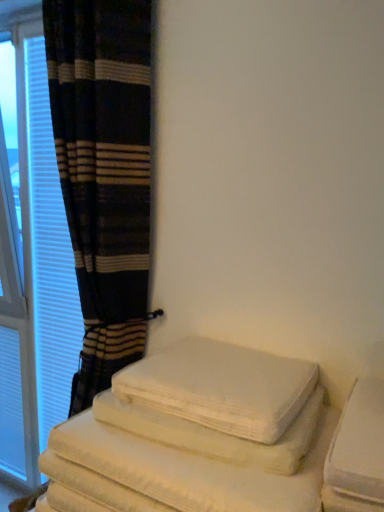
Question: Is white cotton bath towel at lower right in contact with plaid fabric curtain at left?

Choices:
 (A) yes
 (B) no

Answer: (B)

Question: Can you confirm if white cotton bath towel at lower right is shorter than plaid fabric curtain at left?

Choices:
 (A) no
 (B) yes

Answer: (B)

Question: Is white cotton bath towel at lower right oriented away from plaid fabric curtain at left?

Choices:
 (A) no
 (B) yes

Answer: (A)

Question: Is white cotton bath towel at lower right smaller than plaid fabric curtain at left?

Choices:
 (A) yes
 (B) no

Answer: (A)

Question: Can you confirm if white cotton bath towel at lower right is bigger than plaid fabric curtain at left?

Choices:
 (A) yes
 (B) no

Answer: (B)

Question: Is plaid fabric curtain at left wider or thinner than white soft towels at lower left?

Choices:
 (A) thin
 (B) wide

Answer: (A)

Question: Is plaid fabric curtain at left bigger or smaller than white soft towels at lower left?

Choices:
 (A) big
 (B) small

Answer: (A)

Question: From their relative heights in the image, would you say plaid fabric curtain at left is taller or shorter than white soft towels at lower left?

Choices:
 (A) tall
 (B) short

Answer: (A)

Question: Relative to white soft towels at lower left, is plaid fabric curtain at left in front or behind?

Choices:
 (A) front
 (B) behind

Answer: (B)

Question: Is white cotton bath towel at lower right wider or thinner than plaid fabric curtain at left?

Choices:
 (A) thin
 (B) wide

Answer: (A)

Question: Visually, is white cotton bath towel at lower right positioned to the left or to the right of plaid fabric curtain at left?

Choices:
 (A) right
 (B) left

Answer: (A)

Question: From a real-world perspective, is white cotton bath towel at lower right above or below plaid fabric curtain at left?

Choices:
 (A) above
 (B) below

Answer: (B)

Question: In terms of height, does white cotton bath towel at lower right look taller or shorter compared to plaid fabric curtain at left?

Choices:
 (A) short
 (B) tall

Answer: (A)

Question: Is white soft towels at lower left wider or thinner than white textured curtain at left?

Choices:
 (A) wide
 (B) thin

Answer: (A)

Question: Visually, is white soft towels at lower left positioned to the left or to the right of white textured curtain at left?

Choices:
 (A) left
 (B) right

Answer: (B)